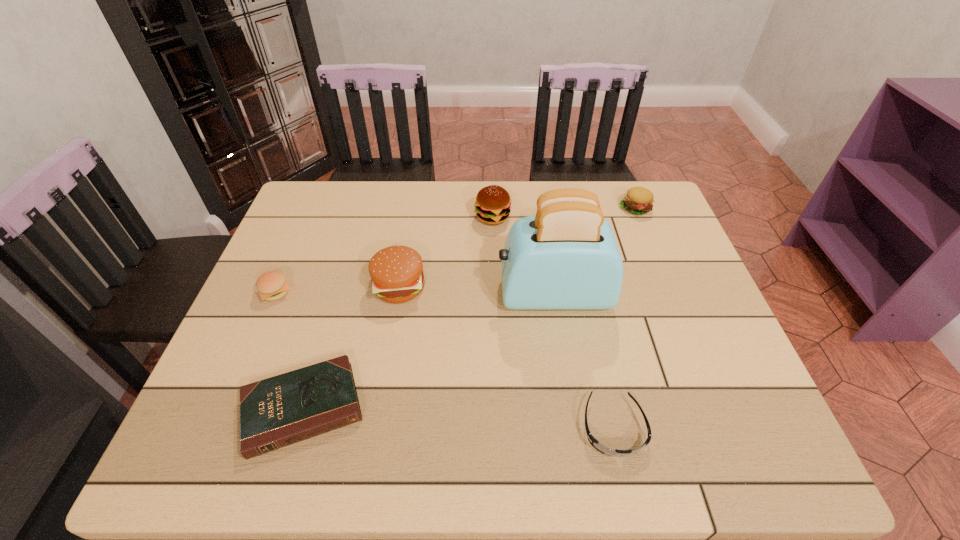
Where is `object present at the near left corner`? The image size is (960, 540). object present at the near left corner is located at coordinates (288, 408).

I want to click on object that is at the far right corner, so click(x=639, y=200).

Image resolution: width=960 pixels, height=540 pixels. I want to click on free region at the far edge of the desktop, so click(x=466, y=181).

You are a GUI agent. You are given a task and a screenshot of the screen. Output one action in this format:
    pyautogui.click(x=<x>, y=<y>)
    Task: Click on the vacant space at the near edge of the desktop
    This screenshot has width=960, height=540.
    Given the screenshot: What is the action you would take?
    pyautogui.click(x=482, y=448)

Where is `vacant position at the left edge of the desktop`? vacant position at the left edge of the desktop is located at coordinates (297, 267).

Locate an element on the screen. The height and width of the screenshot is (540, 960). vacant space at the right edge of the desktop is located at coordinates (627, 232).

Image resolution: width=960 pixels, height=540 pixels. In the image, there is a desktop. Find the location of `vacant space at the far left corner`. vacant space at the far left corner is located at coordinates (313, 204).

Where is `free space at the far right corner of the desktop`? The image size is (960, 540). free space at the far right corner of the desktop is located at coordinates (643, 225).

Identify the location of free space between the sunglasses and the leftmost hamburger. This screenshot has width=960, height=540. (444, 360).

Find the location of a particular element. This screenshot has height=540, width=960. free space between the Bible and the leftmost hamburger is located at coordinates (289, 350).